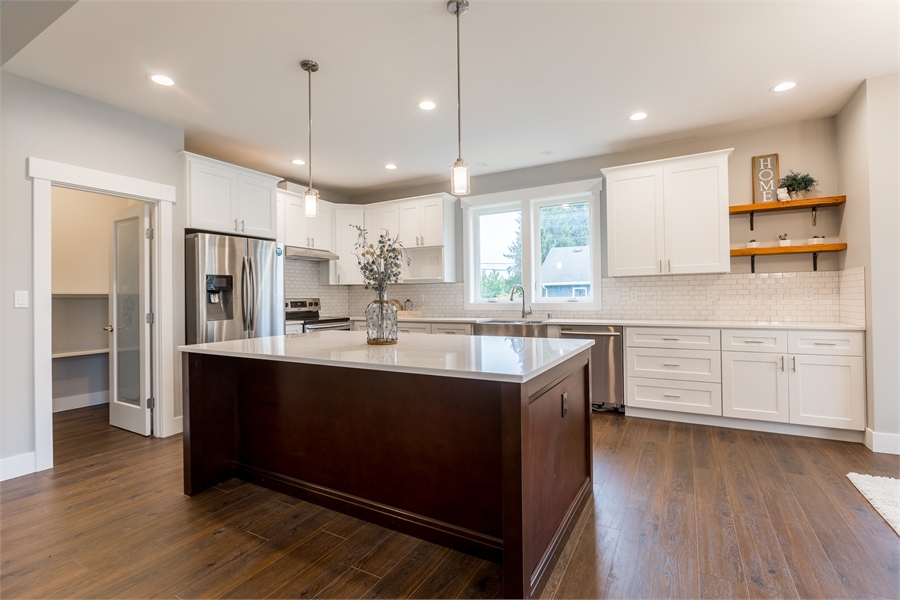
The width and height of the screenshot is (900, 600). I want to click on drawer pulls, so click(402, 328), click(446, 329), click(671, 338), click(670, 362), click(669, 396), click(753, 342), click(821, 343).